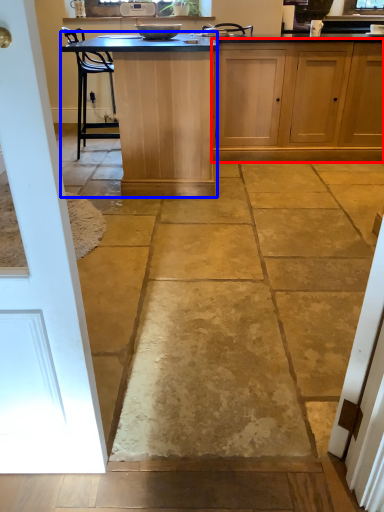
Question: Which point is further to the camera, cabinetry (highlighted by a red box) or table (highlighted by a blue box)?

Choices:
 (A) cabinetry
 (B) table

Answer: (A)